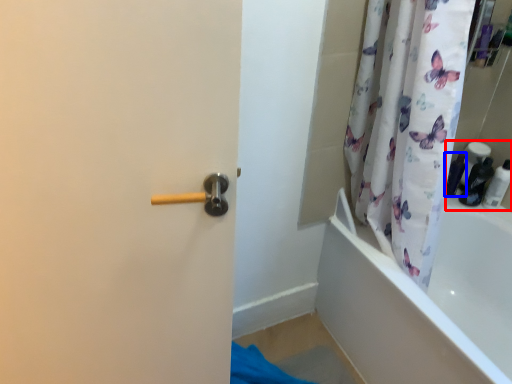
Question: Among these objects, which one is farthest to the camera, toiletry (highlighted by a red box) or toiletry (highlighted by a blue box)?

Choices:
 (A) toiletry
 (B) toiletry

Answer: (B)